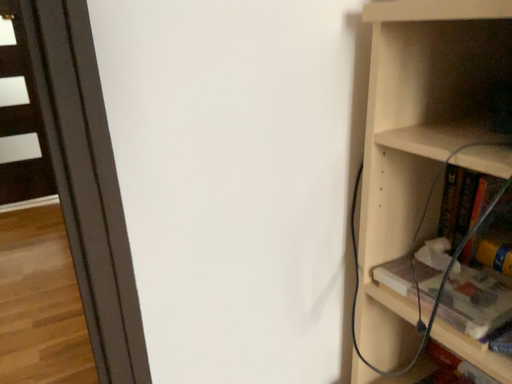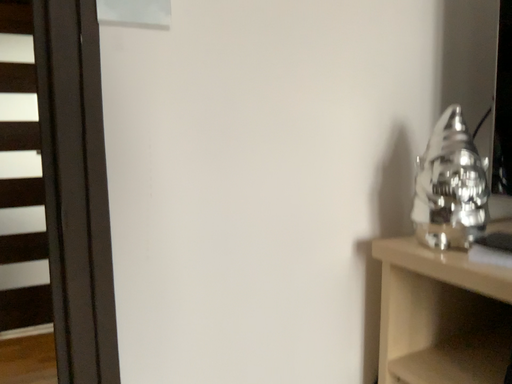
Question: How did the camera likely rotate when shooting the video?

Choices:
 (A) rotated upward
 (B) rotated downward

Answer: (A)